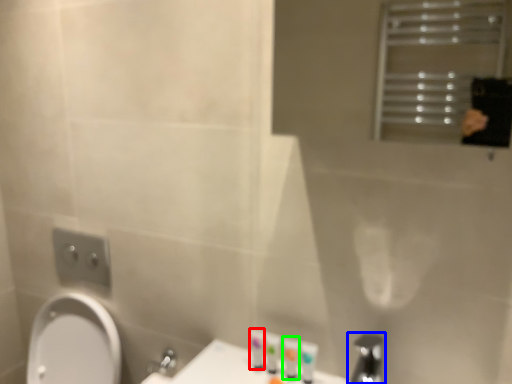
Question: Considering the real-world distances, which object is farthest from toiletry (highlighted by a red box)? tap (highlighted by a blue box) or toiletry (highlighted by a green box)?

Choices:
 (A) tap
 (B) toiletry

Answer: (A)